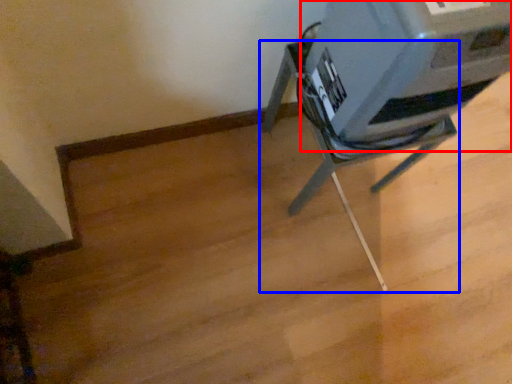
Question: Among these objects, which one is nearest to the camera, printer (highlighted by a red box) or furniture (highlighted by a blue box)?

Choices:
 (A) printer
 (B) furniture

Answer: (A)